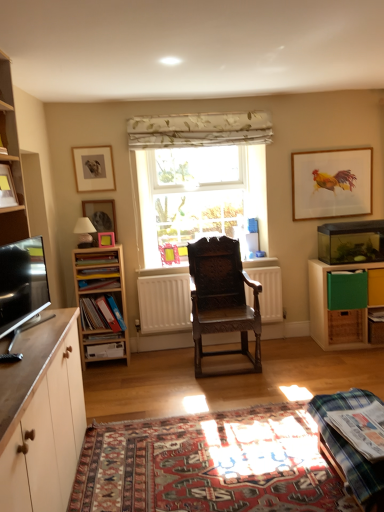
This screenshot has width=384, height=512. Describe the element at coordinates (84, 232) in the screenshot. I see `matte black lampshade at upper left` at that location.

Describe the element at coordinates (94, 168) in the screenshot. I see `matte wooden picture frame at upper left, which is the 4th picture frame in right-to-left order` at that location.

Image resolution: width=384 pixels, height=512 pixels. What do you see at coordinates (222, 298) in the screenshot?
I see `dark wood carved chair at center` at bounding box center [222, 298].

What do you see at coordinates (96, 272) in the screenshot? I see `matte plastic book at center-left, arranged as the 2th book when viewed from the top` at bounding box center [96, 272].

The width and height of the screenshot is (384, 512). Describe the element at coordinates (332, 183) in the screenshot. I see `watercolor paper rooster at upper right, the fourth picture frame positioned from the front` at that location.

What do you see at coordinates (106, 239) in the screenshot? The image size is (384, 512). I see `matte wooden picture frame at center, which ranks as the 2th picture frame in right-to-left order` at bounding box center [106, 239].

Locate an element on the screen. This screenshot has height=512, width=384. matte black lampshade at upper left is located at coordinates (84, 232).

Consider the image. Is there a large distance between plaid fabric table at lower right and green wood cube at right, the 2th cabinetry positioned from the left?

plaid fabric table at lower right is far away from green wood cube at right, the 2th cabinetry positioned from the left.

Which point is more distant from viewer, (346,396) or (328,349)?

The point (328,349) is farther from the camera.

Is plaid fabric table at lower right wider or thinner than green wood cube at right, the 1th cabinetry when ordered from back to front?

Considering their sizes, plaid fabric table at lower right looks broader than green wood cube at right, the 1th cabinetry when ordered from back to front.

Does plaid fabric table at lower right turn towards green wood cube at right, the first cabinetry from the right?

No, plaid fabric table at lower right is not turned towards green wood cube at right, the first cabinetry from the right.

Who is taller, matte plastic book at center-left, arranged as the 4th book when ordered from the bottom, or green cardboard book at center-right, the 1th book viewed from the right?

green cardboard book at center-right, the 1th book viewed from the right.

Is matte plastic book at center-left, marked as the 5th book in a right-to-left arrangement, positioned behind green cardboard book at center-right, acting as the fifth book starting from the front?

No, matte plastic book at center-left, marked as the 5th book in a right-to-left arrangement, is in front of green cardboard book at center-right, acting as the fifth book starting from the front.

From the image's perspective, which is below, matte plastic book at center-left, the 3th book from the front, or green cardboard book at center-right, the 1th book viewed from the right?

green cardboard book at center-right, the 1th book viewed from the right, from the image's perspective.

Is matte plastic book at center-left, the 3th book from the front, surrounding green cardboard book at center-right, which is counted as the 4th book, starting from the top?

No, green cardboard book at center-right, which is counted as the 4th book, starting from the top, is not a part of matte plastic book at center-left, the 3th book from the front.

Considering the positions of point (381, 275) and point (115, 499), is point (381, 275) closer or farther from the camera than point (115, 499)?

Point (381, 275) is positioned farther from the camera compared to point (115, 499).

Is green plastic drawer at right, acting as the first drawer starting from the top, in front of or behind carpet at center in the image?

Clearly, green plastic drawer at right, acting as the first drawer starting from the top, is behind carpet at center.

What are the coordinates of `the 2nd drawer directly above the carpet at center (from a real-world perspective)` in the screenshot? It's located at (376, 287).

Looking at their sizes, would you say matte black lampshade at upper left is wider or thinner than matte blue book at left, which is counted as the second book, starting from the back?

Clearly, matte black lampshade at upper left has more width compared to matte blue book at left, which is counted as the second book, starting from the back.

Are matte black lampshade at upper left and matte blue book at left, which is counted as the second book, starting from the back, beside each other?

There is a gap between matte black lampshade at upper left and matte blue book at left, which is counted as the second book, starting from the back.

Is point (92, 226) closer to camera compared to point (95, 287)?

No, it is behind (95, 287).

From a real-world perspective, which is physically below, matte black lampshade at upper left or matte blue book at left, placed as the fourth book when sorted from front to back?

matte blue book at left, placed as the fourth book when sorted from front to back, from a real-world perspective.

From the image's perspective, which one is positioned lower, green wood cube at right, the first cabinetry from the right, or matte plastic book at left, marked as the 2th book in a front-to-back arrangement?

green wood cube at right, the first cabinetry from the right, appears lower in the image.

Between point (361, 316) and point (103, 253), which one is positioned behind?

The point (361, 316) is more distant.

From a real-world perspective, is green wood cube at right, the first cabinetry from the right, under matte plastic book at left, marked as the fourth book in a back-to-front arrangement?

Yes, from a real-world perspective, green wood cube at right, the first cabinetry from the right, is beneath matte plastic book at left, marked as the fourth book in a back-to-front arrangement.

Considering the relative positions of plaid fabric table at lower right and matte black lampshade at upper left in the image provided, is plaid fabric table at lower right to the right of matte black lampshade at upper left from the viewer's perspective?

Correct, you'll find plaid fabric table at lower right to the right of matte black lampshade at upper left.

Is point (352, 390) positioned before point (80, 227)?

Yes, it is.

Consider the image. Is plaid fabric table at lower right positioned with its back to matte black lampshade at upper left?

No.

Would you say plaid fabric table at lower right is outside matte black lampshade at upper left?

Yes, plaid fabric table at lower right is outside of matte black lampshade at upper left.

Is black glossy tv at left situated inside matte plastic book at center-left, the 3th book from the front, or outside?

black glossy tv at left is outside matte plastic book at center-left, the 3th book from the front.

Which is more to the left, black glossy tv at left or matte plastic book at center-left, the 3th book from the front?

Positioned to the left is black glossy tv at left.

Does black glossy tv at left have a greater width compared to matte plastic book at center-left, the 3th book from the front?

No.

From a real-world perspective, which cabinetry is the 1st one above the plaid fabric table at lower right? Please provide its 2D coordinates.

[(339, 309)]

Where is `book that is the 3rd one below the matte plastic book at center-left, the 1th book positioned from the left (from a real-world perspective)`? book that is the 3rd one below the matte plastic book at center-left, the 1th book positioned from the left (from a real-world perspective) is located at coordinates (x=376, y=315).

Looking at the image, which one is located closer to watercolor paper rooster at upper right, the fourth picture frame positioned from the front, wooden bookshelf at left, which is the 3th shelf from front to back, or matte wooden picture frame at upper left, the 2th picture frame viewed from the front?

Based on the image, matte wooden picture frame at upper left, the 2th picture frame viewed from the front, appears to be nearer to watercolor paper rooster at upper right, the fourth picture frame positioned from the front.

Considering their positions, is matte plastic book at left, which appears as the first book when viewed from the top, positioned closer to dark wood carved chair at center than green plastic drawer at right, which ranks as the 2th drawer in bottom-to-top order?

Based on the image, matte plastic book at left, which appears as the first book when viewed from the top, appears to be nearer to dark wood carved chair at center.

Consider the image. When comparing their distances from matte plastic book at left, positioned as the 5th book in bottom-to-top order, does matte wooden picture frame at center, the fourth picture frame positioned from the back, or matte plastic book at center-left, the 3th book from the front, seem closer?

Among the two, matte plastic book at center-left, the 3th book from the front, is located nearer to matte plastic book at left, positioned as the 5th book in bottom-to-top order.

Considering their positions, is dark wood carved chair at center positioned closer to plaid fabric table at lower right than white floral fabric at center?

dark wood carved chair at center.

Based on the photo, based on their spatial positions, is matte blue book at left, arranged as the third book when viewed from the left, or white wood shelf at left, which is counted as the 2th shelf, starting from the left, further from white matte cabinet at lower left, arranged as the first cabinetry when viewed from the front?

matte blue book at left, arranged as the third book when viewed from the left.

From the image, which object appears to be nearer to white matte radiator at center, matte blue book at left, placed as the fourth book when sorted from front to back, or pink plastic picture frame at left, which is the third picture frame from right to left?

matte blue book at left, placed as the fourth book when sorted from front to back.

Which object lies nearer to the anchor point white wood shelf at left, marked as the 1th shelf in a front-to-back arrangement, plaid fabric book at lower right, which ranks as the 4th book in left-to-right order, or matte plastic book at center-left, arranged as the 2th book when viewed from the top?

Based on the image, matte plastic book at center-left, arranged as the 2th book when viewed from the top, appears to be nearer to white wood shelf at left, marked as the 1th shelf in a front-to-back arrangement.

From the image, which object appears to be farther from green plastic drawer at right, which ranks as the 2th drawer in bottom-to-top order, matte wooden picture frame at center, which is counted as the third picture frame, starting from the left, or plaid fabric book at lower right, which is counted as the 5th book, starting from the back?

The object further to green plastic drawer at right, which ranks as the 2th drawer in bottom-to-top order, is matte wooden picture frame at center, which is counted as the third picture frame, starting from the left.

Image resolution: width=384 pixels, height=512 pixels. I want to click on picture frame between matte wooden picture frame at center, which is counted as the third picture frame, starting from the left, and wooden drawer at right, which ranks as the second drawer in right-to-left order, so click(332, 183).

I want to click on television between white matte cabinet at lower left, the 1th cabinetry positioned from the left, and green cardboard box at right, the 4th shelf positioned from the left, along the z-axis, so click(22, 283).

I want to click on book between wooden bookshelf at left, the 3th shelf in the left-to-right sequence, and green wood cube at right, the 1th cabinetry when ordered from back to front, so click(361, 429).

What are the coordinates of `chair situated between matte blue book at left, arranged as the third book when viewed from the left, and green plastic drawer at right, which ranks as the 2th drawer in bottom-to-top order, from left to right` in the screenshot? It's located at (222, 298).